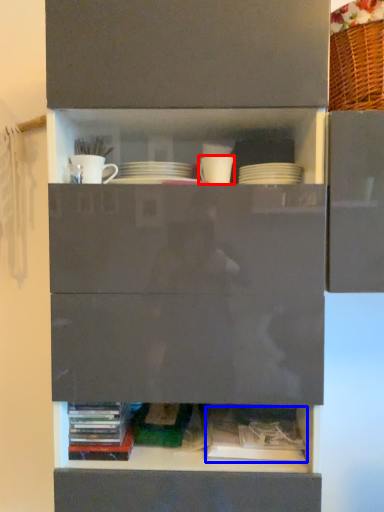
Question: Which point is further to the camera, tableware (highlighted by a red box) or book (highlighted by a blue box)?

Choices:
 (A) tableware
 (B) book

Answer: (A)